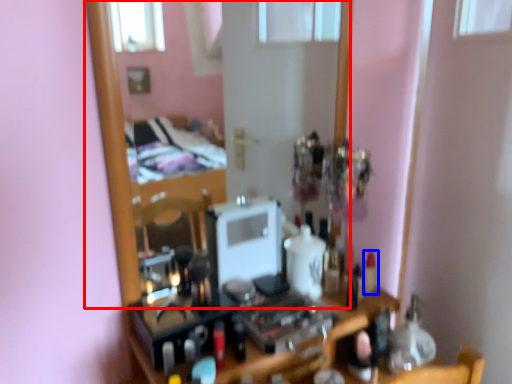
Question: Which object is closer to the camera taking this photo, mirror (highlighted by a red box) or toiletry (highlighted by a blue box)?

Choices:
 (A) mirror
 (B) toiletry

Answer: (A)